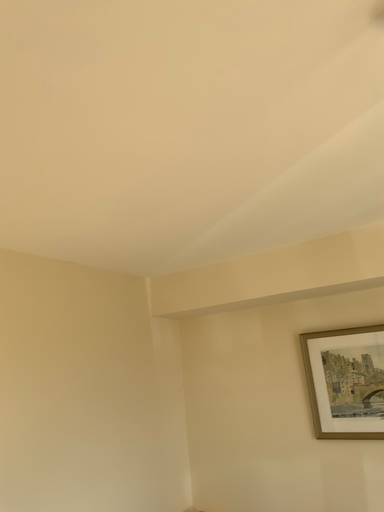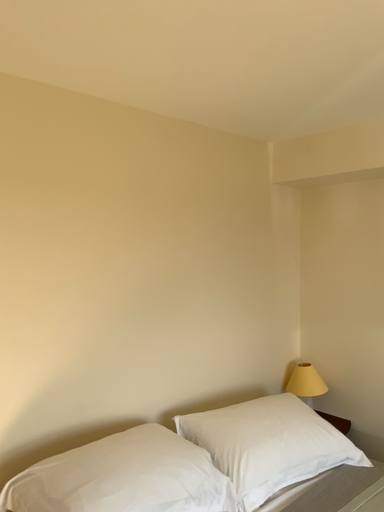
Question: How did the camera likely rotate when shooting the video?

Choices:
 (A) rotated upward
 (B) rotated downward

Answer: (B)